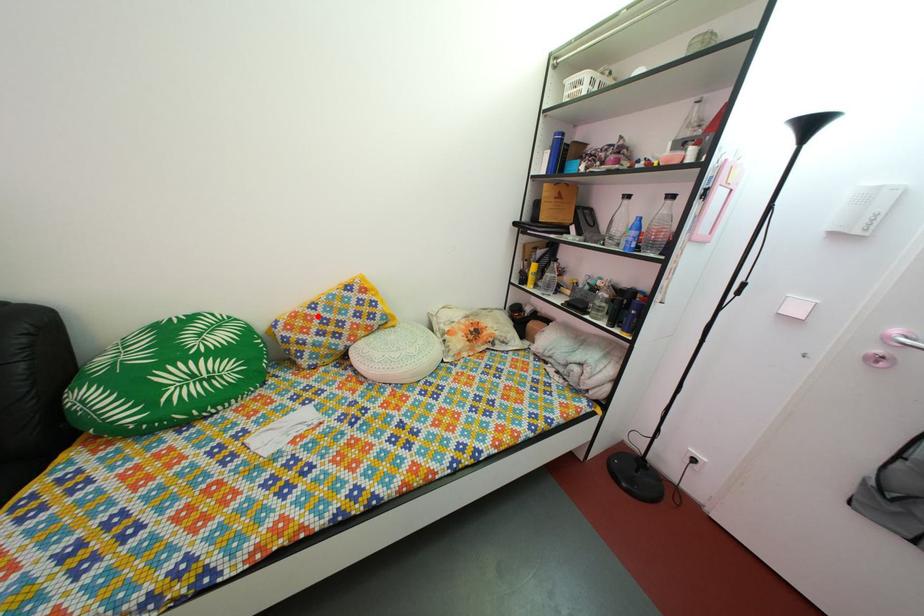
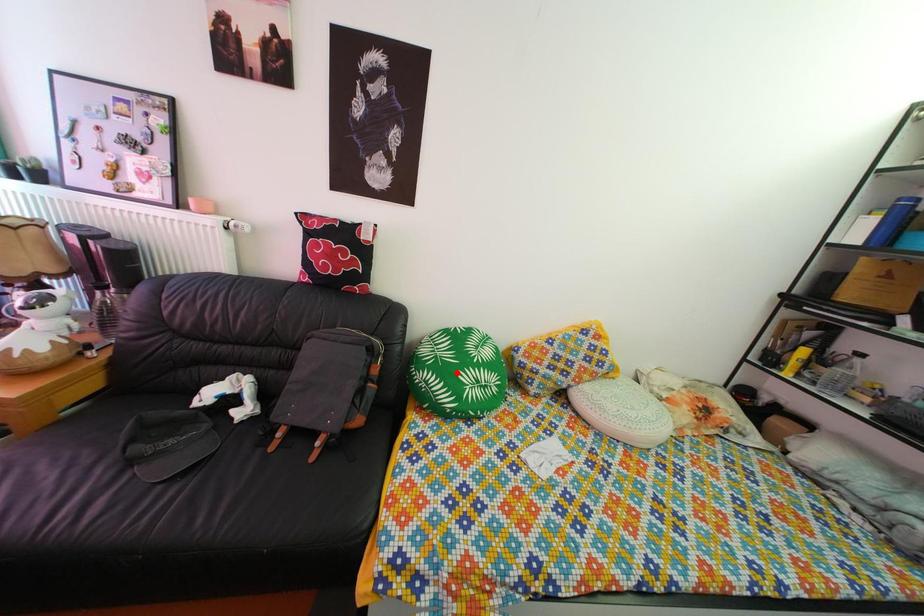
I am providing you with two images of the same scene from different viewpoints. A red point is marked on the first image and another point is marked on the second image. Is the marked point in image1 the same physical position as the marked point in image2?

No